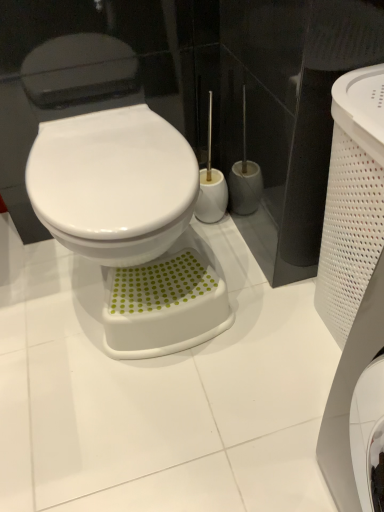
The image size is (384, 512). I want to click on green dotted plastic step stool at lower center, so click(x=164, y=306).

Measure the distance between point (157, 327) and camera.

1.04 meters.

In order to face green dotted plastic step stool at lower center, should I rotate leftwards or rightwards?

You should rotate left by 4.615 degrees.

From the picture: What is the approximate width of green dotted plastic step stool at lower center?

The width of green dotted plastic step stool at lower center is 9.33 inches.

What do you see at coordinates (164, 306) in the screenshot? I see `green dotted plastic step stool at lower center` at bounding box center [164, 306].

Measure the distance between green dotted plastic step stool at lower center and camera.

1.02 meters.

Describe the element at coordinates (113, 184) in the screenshot. Image resolution: width=384 pixels, height=512 pixels. I see `white glossy bidet at center` at that location.

The image size is (384, 512). Find the location of `white glossy bidet at center`. white glossy bidet at center is located at coordinates (113, 184).

Locate an element on the screen. The height and width of the screenshot is (512, 384). green dotted plastic step stool at lower center is located at coordinates (164, 306).

From the picture: Between green dotted plastic step stool at lower center and white glossy bidet at center, which one appears on the right side from the viewer's perspective?

green dotted plastic step stool at lower center.

Relative to white glossy bidet at center, is green dotted plastic step stool at lower center in front or behind?

green dotted plastic step stool at lower center is positioned farther from the viewer than white glossy bidet at center.

Which is nearer, (111, 349) or (62, 224)?

Point (62, 224)

Looking at this image, from the image's perspective, is green dotted plastic step stool at lower center over white glossy bidet at center?

No, from the image's perspective, green dotted plastic step stool at lower center is not over white glossy bidet at center.

From a real-world perspective, who is located higher, green dotted plastic step stool at lower center or white glossy bidet at center?

white glossy bidet at center.

Which of these two, green dotted plastic step stool at lower center or white glossy bidet at center, is wider?

white glossy bidet at center is wider.

Can you confirm if green dotted plastic step stool at lower center is taller than white glossy bidet at center?

No, green dotted plastic step stool at lower center is not taller than white glossy bidet at center.

Considering the sizes of green dotted plastic step stool at lower center and white glossy bidet at center in the image, is green dotted plastic step stool at lower center bigger or smaller than white glossy bidet at center?

In the image, green dotted plastic step stool at lower center appears to be smaller than white glossy bidet at center.

Is green dotted plastic step stool at lower center not inside white glossy bidet at center?

Indeed, green dotted plastic step stool at lower center is completely outside white glossy bidet at center.

Is the surface of green dotted plastic step stool at lower center in direct contact with white glossy bidet at center?

No, green dotted plastic step stool at lower center is not making contact with white glossy bidet at center.

Is green dotted plastic step stool at lower center turned away from white glossy bidet at center?

green dotted plastic step stool at lower center does not have its back to white glossy bidet at center.

You are a GUI agent. You are given a task and a screenshot of the screen. Output one action in this format:
    pyautogui.click(x=<x>, y=<y>)
    Task: Click on the porcelain below the white glossy bidet at center (from the image's perspective)
    The image size is (384, 512).
    Given the screenshot: What is the action you would take?
    pyautogui.click(x=164, y=306)

Which is more to the right, white glossy bidet at center or green dotted plastic step stool at lower center?

From the viewer's perspective, green dotted plastic step stool at lower center appears more on the right side.

In the scene shown: Considering their positions, is white glossy bidet at center located in front of or behind green dotted plastic step stool at lower center?

white glossy bidet at center is positioned closer to the viewer than green dotted plastic step stool at lower center.

Between point (82, 219) and point (152, 295), which one is positioned behind?

Positioned behind is point (152, 295).

From the image's perspective, is white glossy bidet at center below green dotted plastic step stool at lower center?

No.

From a real-world perspective, which object rests below the other?

green dotted plastic step stool at lower center, from a real-world perspective.

Is white glossy bidet at center wider than green dotted plastic step stool at lower center?

Indeed, white glossy bidet at center has a greater width compared to green dotted plastic step stool at lower center.

Who is taller, white glossy bidet at center or green dotted plastic step stool at lower center?

white glossy bidet at center.

Considering the sizes of objects white glossy bidet at center and green dotted plastic step stool at lower center in the image provided, who is smaller, white glossy bidet at center or green dotted plastic step stool at lower center?

With smaller size is green dotted plastic step stool at lower center.

Choose the correct answer: Is white glossy bidet at center inside green dotted plastic step stool at lower center or outside it?

The correct answer is: outside.

Is white glossy bidet at center far from green dotted plastic step stool at lower center?

No, white glossy bidet at center is in close proximity to green dotted plastic step stool at lower center.

Is white glossy bidet at center aimed at green dotted plastic step stool at lower center?

No.

How many degrees apart are the facing directions of white glossy bidet at center and green dotted plastic step stool at lower center?

The angular difference between white glossy bidet at center and green dotted plastic step stool at lower center is 0.0735 degrees.

How distant is white glossy bidet at center from green dotted plastic step stool at lower center?

10.39 inches.

Locate an element on the screen. porcelain lying on the right of white glossy bidet at center is located at coordinates (164, 306).

Where is `porcelain lying below the white glossy bidet at center (from the image's perspective)`? porcelain lying below the white glossy bidet at center (from the image's perspective) is located at coordinates (164, 306).

In the image, there is a green dotted plastic step stool at lower center. Identify the location of bidet above it (from the image's perspective). The height and width of the screenshot is (512, 384). (113, 184).